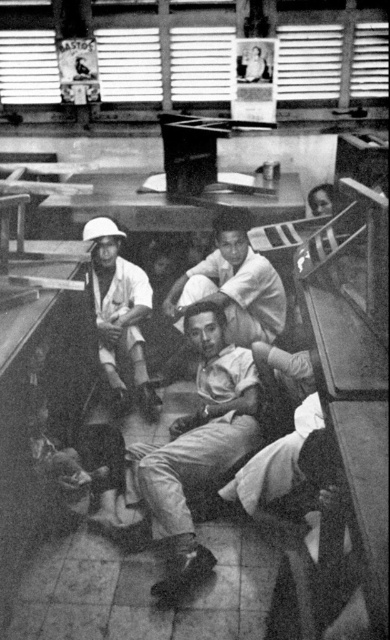
You are a photographer trying to capture a clear shot of the smooth skin man at center and the matte white helmet at upper left. Since the camera can only focus on one subject at a time, which subject should you prioritize to ensure it appears clearer in the photo?

The smooth skin man at center is larger in size than the matte white helmet at upper left, so focusing on the smooth skin man at center will ensure it appears clearer in the photo.

You are a photographer trying to capture a candid shot of the matte white shirt at center and the smooth skin man at center in the train station scene. Since you want both subjects to be clearly visible in the frame, which subject should you focus on to ensure they are in sharp focus, considering their sizes?

The matte white shirt at center has a larger size compared to the smooth skin man at center. Therefore, to ensure both are in sharp focus, you should focus on the matte white shirt at center since it is larger and might be closer to the camera, making it easier to capture both in the same focal plane.